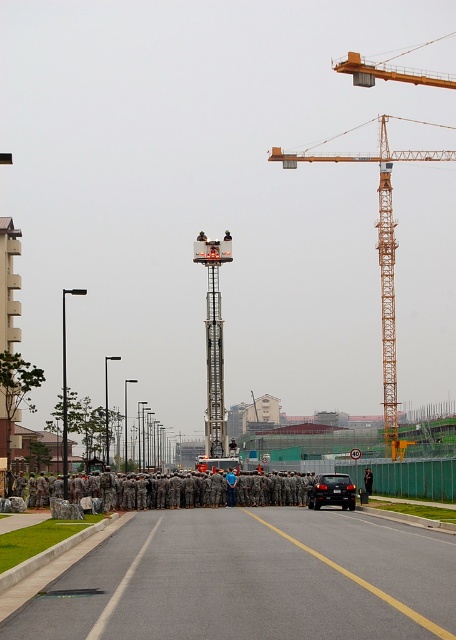
Question: Considering the real-world distances, which object is farthest from the metallic gray tower crane at center?

Choices:
 (A) camouflage uniform at center
 (B) black metal pole at left
 (C) orange metallic crane at upper center

Answer: (A)

Question: Among these points, which one is nearest to the camera?

Choices:
 (A) (366, 474)
 (B) (222, 362)
 (C) (321, 483)

Answer: (C)

Question: Does orange metallic crane at upper center have a larger size compared to metallic gray tower crane at center?

Choices:
 (A) yes
 (B) no

Answer: (A)

Question: Does metallic gray tower crane at center have a larger size compared to black metal pole at left?

Choices:
 (A) no
 (B) yes

Answer: (A)

Question: Can you confirm if asphalt road at center is positioned above black metal pole at left?

Choices:
 (A) yes
 (B) no

Answer: (A)

Question: Which point appears farthest from the camera in this image?

Choices:
 (A) (335, 547)
 (B) (369, 484)
 (C) (214, 284)

Answer: (C)